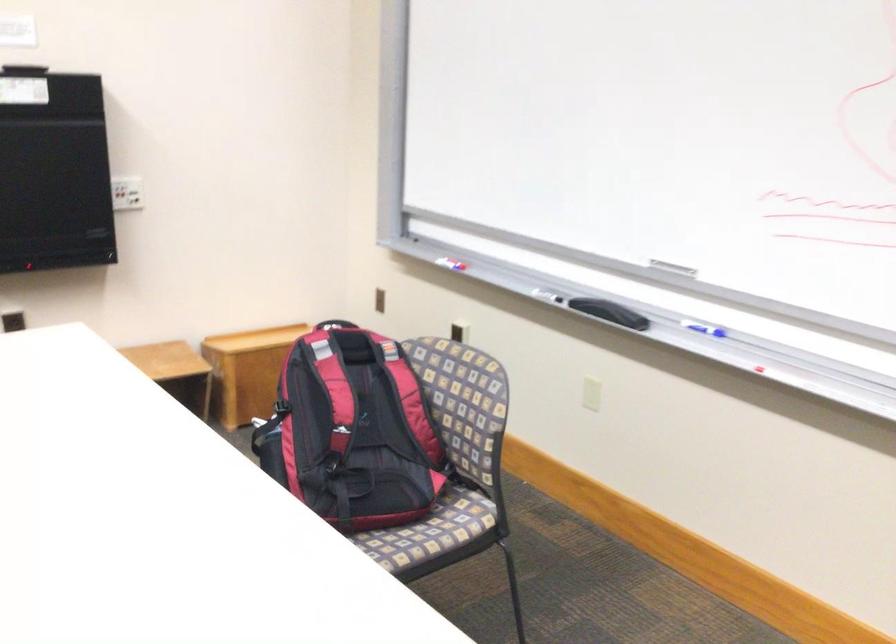
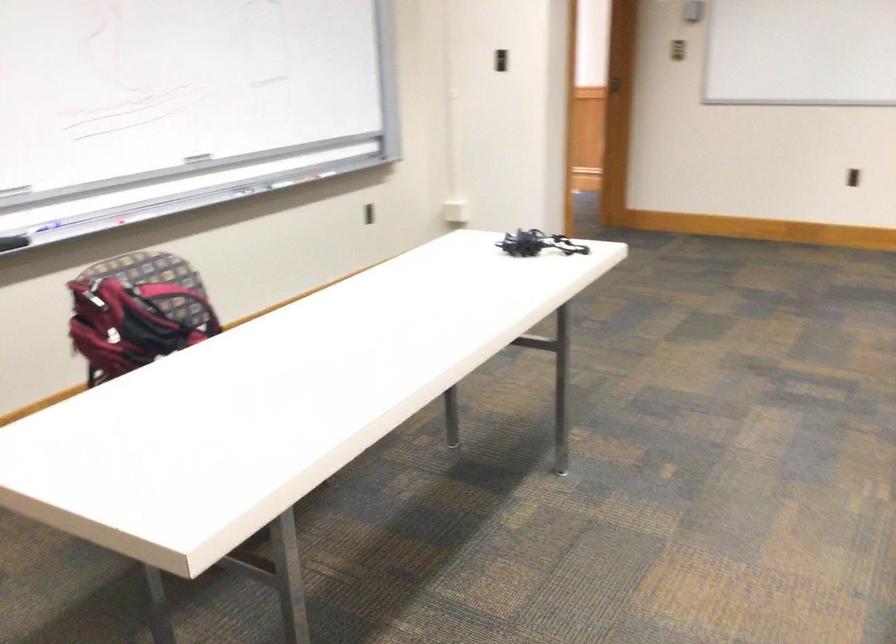
Question: I am providing you with two images of the same scene from different viewpoints. After the viewpoint changes to image2, which objects are now occluded?

Choices:
 (A) white leg clamp
 (B) black whiteboard eraser
 (C) chair sitting surface
 (D) blue whiteboard marker

Answer: (C)